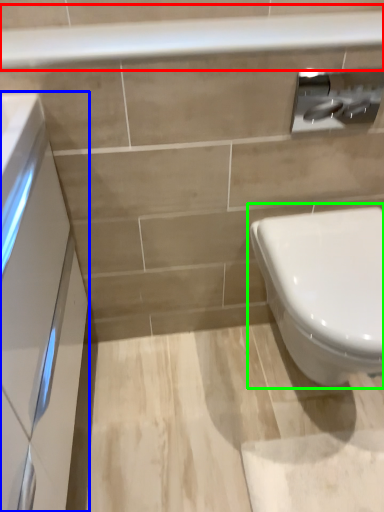
Question: Which object is positioned closest to balustrade (highlighted by a red box)? Select from porcelain (highlighted by a blue box) and toilet (highlighted by a green box).

Choices:
 (A) porcelain
 (B) toilet

Answer: (A)